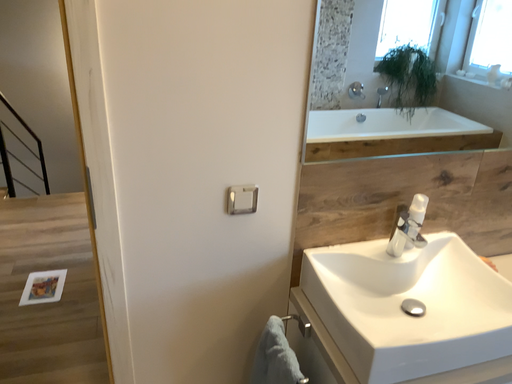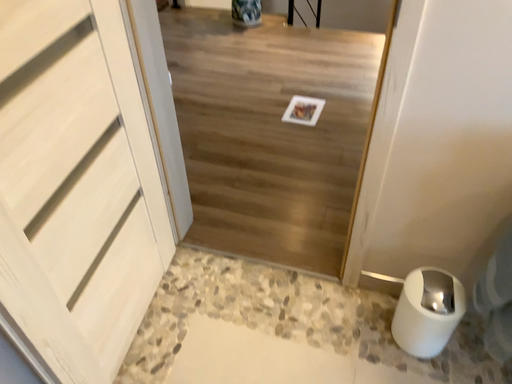
Question: Which way did the camera rotate in the video?

Choices:
 (A) rotated downward
 (B) rotated upward

Answer: (A)